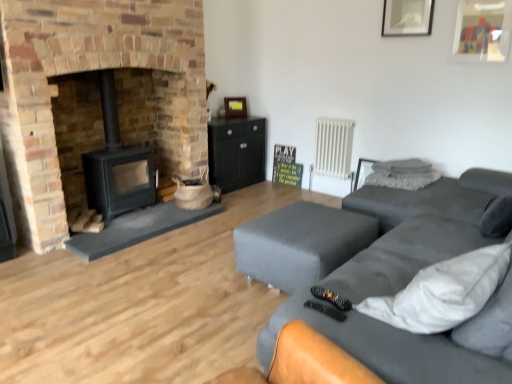
The width and height of the screenshot is (512, 384). In order to click on vacant space in front of wooden picture frame at upper center, positioned as the 1th picture frame in bottom-to-top order in this screenshot , I will do `click(233, 113)`.